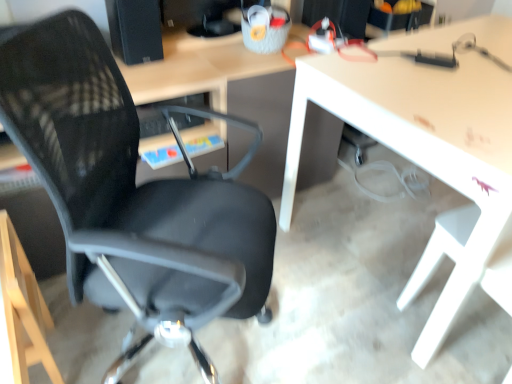
The height and width of the screenshot is (384, 512). What do you see at coordinates (133, 194) in the screenshot?
I see `black mesh chair at left` at bounding box center [133, 194].

This screenshot has height=384, width=512. What do you see at coordinates (135, 30) in the screenshot?
I see `black matte speaker at upper left` at bounding box center [135, 30].

This screenshot has height=384, width=512. I want to click on black matte speaker at upper left, so click(x=135, y=30).

Where is `white glossy table at center`? white glossy table at center is located at coordinates (428, 152).

Is black matte speaker at upper left taller than black mesh chair at left?

Incorrect, the height of black matte speaker at upper left is not larger of that of black mesh chair at left.

Which is less distant, (137,59) or (114,148)?

The point (114,148) is in front.

Can you confirm if black matte speaker at upper left is smaller than black mesh chair at left?

Yes.

Would you say black matte speaker at upper left is a long distance from black mesh chair at left?

Actually, black matte speaker at upper left and black mesh chair at left are a little close together.

Does black mesh chair at left lie behind white glossy table at center?

No, black mesh chair at left is closer to the viewer.

Is black mesh chair at left situated inside white glossy table at center or outside?

black mesh chair at left is not enclosed by white glossy table at center.

Considering the relative positions of black mesh chair at left and white glossy table at center in the image provided, is black mesh chair at left to the left of white glossy table at center from the viewer's perspective?

Correct, you'll find black mesh chair at left to the left of white glossy table at center.

Is black mesh chair at left aimed at white glossy table at center?

Yes, black mesh chair at left faces towards white glossy table at center.

From a real-world perspective, is black matte speaker at upper left positioned over white glossy table at center based on gravity?

Yes, from a real-world perspective, black matte speaker at upper left is above white glossy table at center.

Who is shorter, black matte speaker at upper left or white glossy table at center?

With less height is black matte speaker at upper left.

How different are the orientations of black matte speaker at upper left and white glossy table at center in degrees?

The angle between the facing direction of black matte speaker at upper left and the facing direction of white glossy table at center is 0.693 degrees.

Could white glossy table at center be considered to be inside black matte speaker at upper left?

No.

Considering the positions of objects white glossy table at center and black matte speaker at upper left in the image provided, who is more to the right, white glossy table at center or black matte speaker at upper left?

Positioned to the right is white glossy table at center.

Which of these two, white glossy table at center or black matte speaker at upper left, is wider?

Wider between the two is white glossy table at center.

Which point is more distant from viewer, (494, 260) or (148, 32)?

The point (148, 32) is more distant.

Where is `table located on the right of black matte speaker at upper left`? table located on the right of black matte speaker at upper left is located at coordinates (428, 152).

Where is `desktop computer located above the black mesh chair at left (from a real-world perspective)`? Image resolution: width=512 pixels, height=384 pixels. desktop computer located above the black mesh chair at left (from a real-world perspective) is located at coordinates (135, 30).

Based on the photo, is black mesh chair at left oriented away from black matte speaker at upper left?

No, black matte speaker at upper left is not at the back of black mesh chair at left.

Considering the sizes of objects black mesh chair at left and black matte speaker at upper left in the image provided, who is thinner, black mesh chair at left or black matte speaker at upper left?

black matte speaker at upper left is thinner.

Which object is further away from the camera, black mesh chair at left or black matte speaker at upper left?

Positioned behind is black matte speaker at upper left.

From a real-world perspective, is white glossy table at center positioned under black mesh chair at left based on gravity?

Yes, from a real-world perspective, white glossy table at center is below black mesh chair at left.

How far apart are white glossy table at center and black mesh chair at left?

white glossy table at center is 25.36 inches away from black mesh chair at left.

In the image, is white glossy table at center positioned in front of or behind black mesh chair at left?

white glossy table at center is behind black mesh chair at left.

From the image's perspective, between white glossy table at center and black mesh chair at left, which one is located above?

white glossy table at center appears higher in the image.

Locate an element on the screen. This screenshot has width=512, height=384. desktop computer that appears on the left of black mesh chair at left is located at coordinates (135, 30).

Identify the location of chair lying in front of the white glossy table at center. The height and width of the screenshot is (384, 512). (133, 194).

Which object lies further to the anchor point black mesh chair at left, black matte speaker at upper left or white glossy table at center?

Based on the image, black matte speaker at upper left appears to be further to black mesh chair at left.

Estimate the real-world distances between objects in this image. Which object is closer to black matte speaker at upper left, black mesh chair at left or white glossy table at center?

black mesh chair at left lies closer to black matte speaker at upper left than the other object.

Which object lies further to the anchor point black matte speaker at upper left, white glossy table at center or black mesh chair at left?

Based on the image, white glossy table at center appears to be further to black matte speaker at upper left.

Estimate the real-world distances between objects in this image. Which object is closer to white glossy table at center, black matte speaker at upper left or black mesh chair at left?

black mesh chair at left.

Based on their spatial positions, is white glossy table at center or black matte speaker at upper left closer to black mesh chair at left?

white glossy table at center is positioned closer to the anchor black mesh chair at left.

Considering their positions, is black mesh chair at left positioned closer to white glossy table at center than black matte speaker at upper left?

black mesh chair at left lies closer to white glossy table at center than the other object.

You are a GUI agent. You are given a task and a screenshot of the screen. Output one action in this format:
    pyautogui.click(x=<x>, y=<y>)
    Task: Click on the chair between black matte speaker at upper left and white glossy table at center in the horizontal direction
    The height and width of the screenshot is (384, 512).
    Given the screenshot: What is the action you would take?
    pyautogui.click(x=133, y=194)